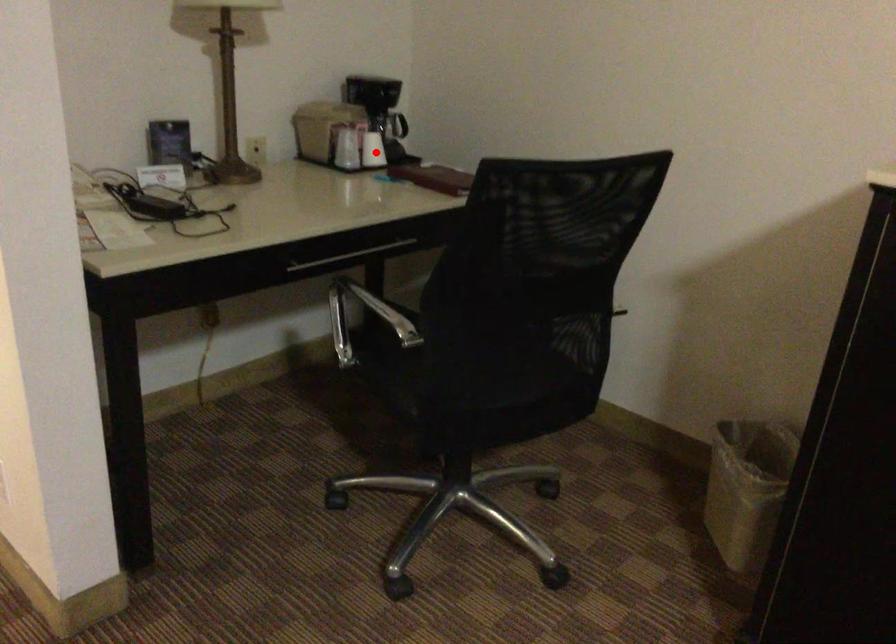
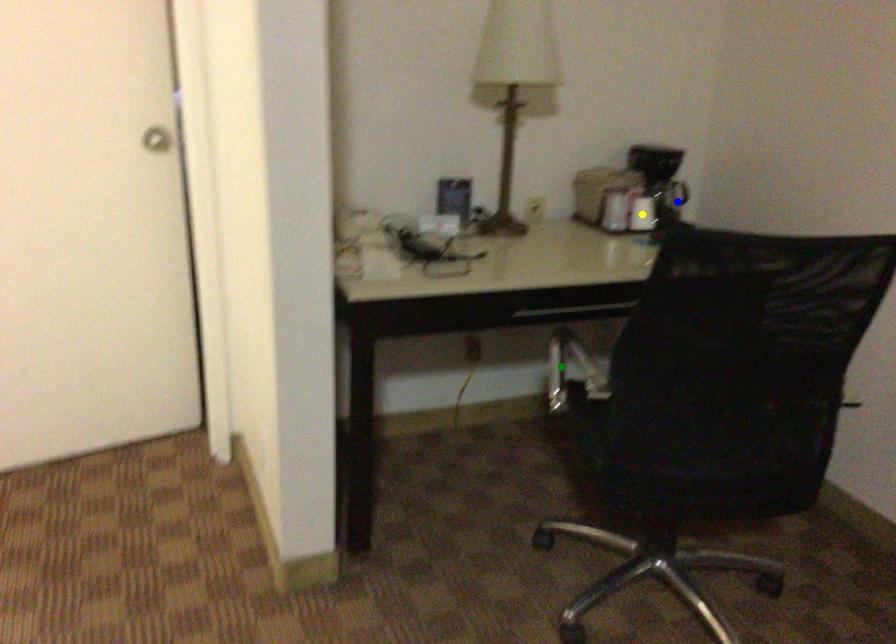
Question: I am providing you with two images of the same scene from different viewpoints. A red point is marked on the first image. You are given multiple points on the second image. Which point in image 2 represents the same 3d spot as the red point in image 1?

Choices:
 (A) green point
 (B) blue point
 (C) yellow point

Answer: (C)